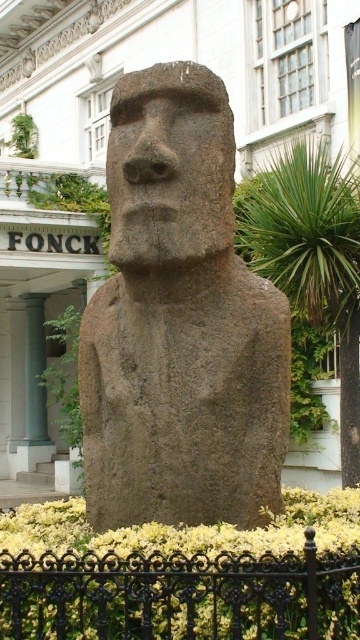
Question: Can you confirm if brown stone head at center is bigger than green stone column at left?

Choices:
 (A) yes
 (B) no

Answer: (A)

Question: Can you confirm if brown stone head at center is positioned below green stone column at left?

Choices:
 (A) yes
 (B) no

Answer: (B)

Question: Which of the following is the farthest from the observer?

Choices:
 (A) (196, 132)
 (B) (32, 413)

Answer: (B)

Question: Estimate the real-world distances between objects in this image. Which object is closer to the brown stone statue at center?

Choices:
 (A) brown stone head at center
 (B) green stone column at left

Answer: (A)

Question: Does brown stone statue at center have a greater width compared to green stone column at left?

Choices:
 (A) no
 (B) yes

Answer: (A)

Question: Which point is closer to the camera?

Choices:
 (A) (129, 92)
 (B) (18, 465)

Answer: (A)